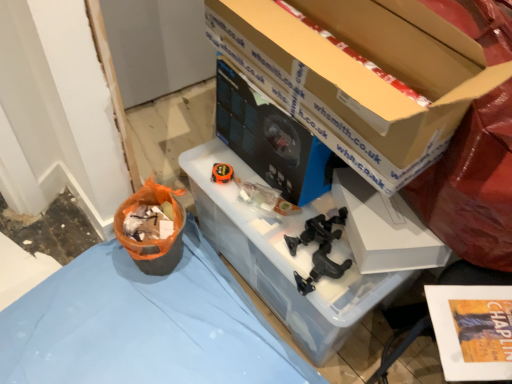
Locate an element on the screen. vacant space in blue fabric at center (from a real-world perspective) is located at coordinates (159, 331).